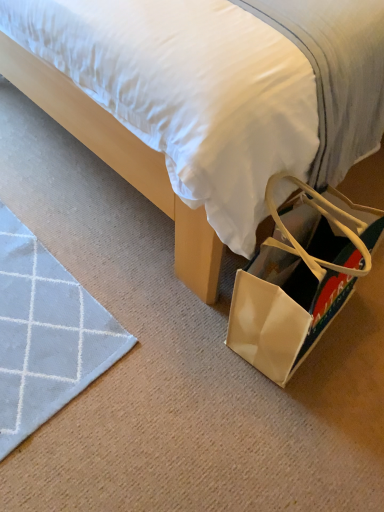
Where is `free space to the left of matte beige shoulder bag at lower right`? Image resolution: width=384 pixels, height=512 pixels. free space to the left of matte beige shoulder bag at lower right is located at coordinates (172, 325).